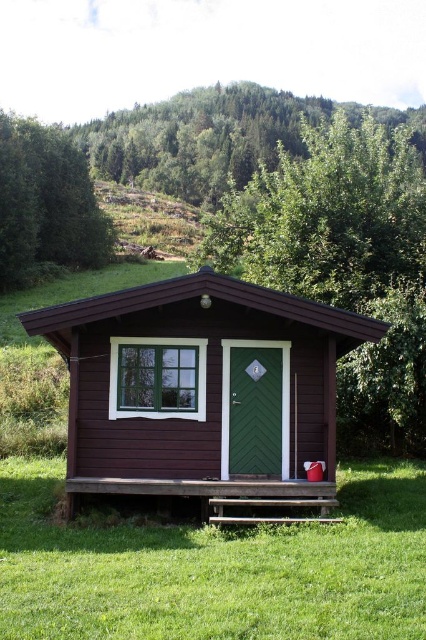
Question: Considering the real-world distances, which object is farthest from the dark brown wood cabin at center?

Choices:
 (A) green textured tree at upper left
 (B) green wood tree at center

Answer: (A)

Question: Is dark brown wood cabin at center above green wood tree at center?

Choices:
 (A) no
 (B) yes

Answer: (A)

Question: Does green wood tree at center appear under green textured tree at upper left?

Choices:
 (A) yes
 (B) no

Answer: (B)

Question: Which of the following is the closest to the observer?

Choices:
 (A) (244, 115)
 (B) (233, 298)

Answer: (B)

Question: Among these objects, which one is farthest from the camera?

Choices:
 (A) green textured tree at upper left
 (B) dark brown wood cabin at center
 (C) green wood tree at center
 (D) green leafy tree at upper center

Answer: (D)

Question: Does dark brown wood cabin at center appear under green textured tree at upper left?

Choices:
 (A) no
 (B) yes

Answer: (B)